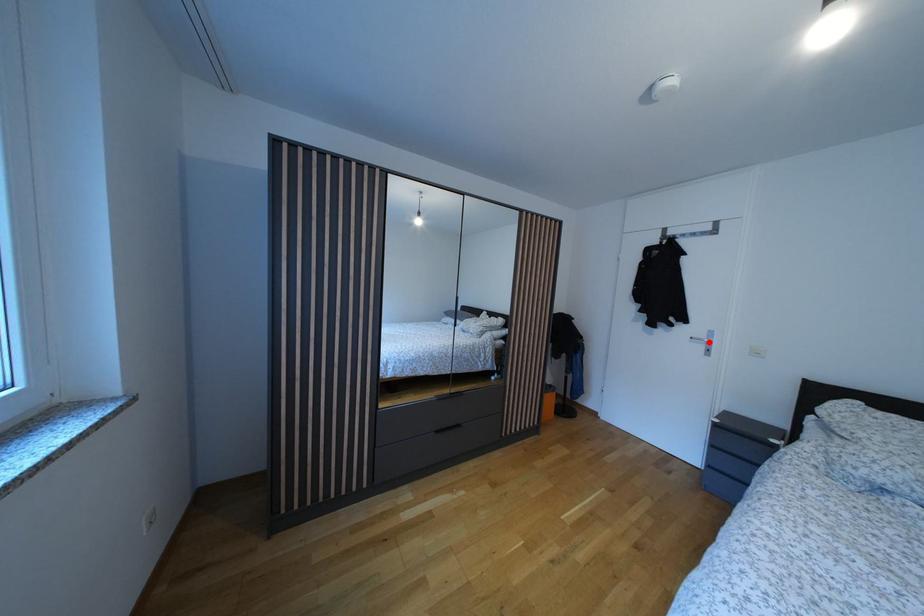
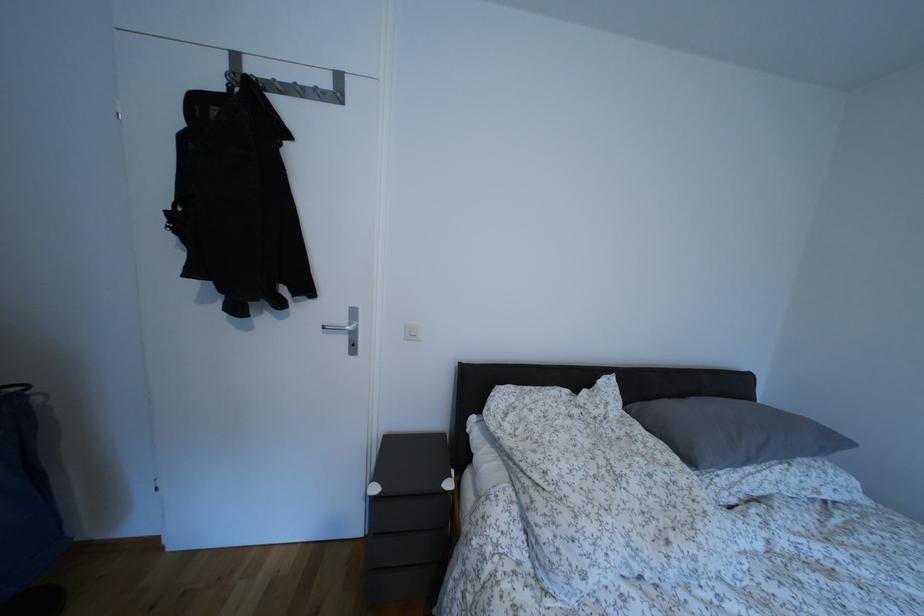
The point at the highlighted location is marked in the first image. Where is the corresponding point in the second image?

(348, 325)